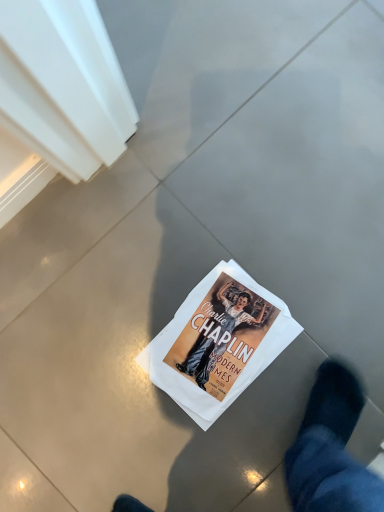
This screenshot has width=384, height=512. What do you see at coordinates (256, 369) in the screenshot? I see `white paper comic book at center` at bounding box center [256, 369].

I want to click on white paper comic book at center, so click(x=256, y=369).

This screenshot has height=512, width=384. I want to click on white paper comic book at center, so click(x=256, y=369).